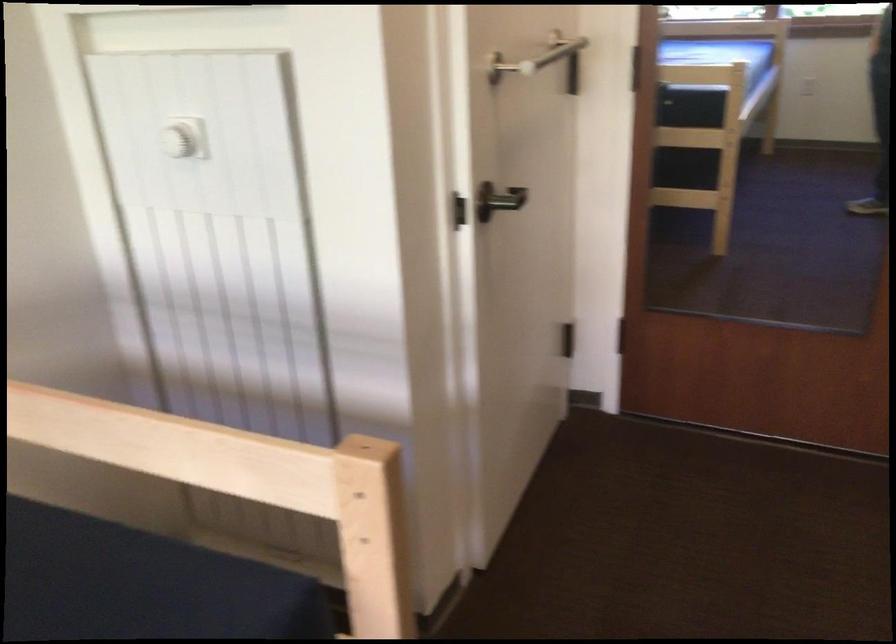
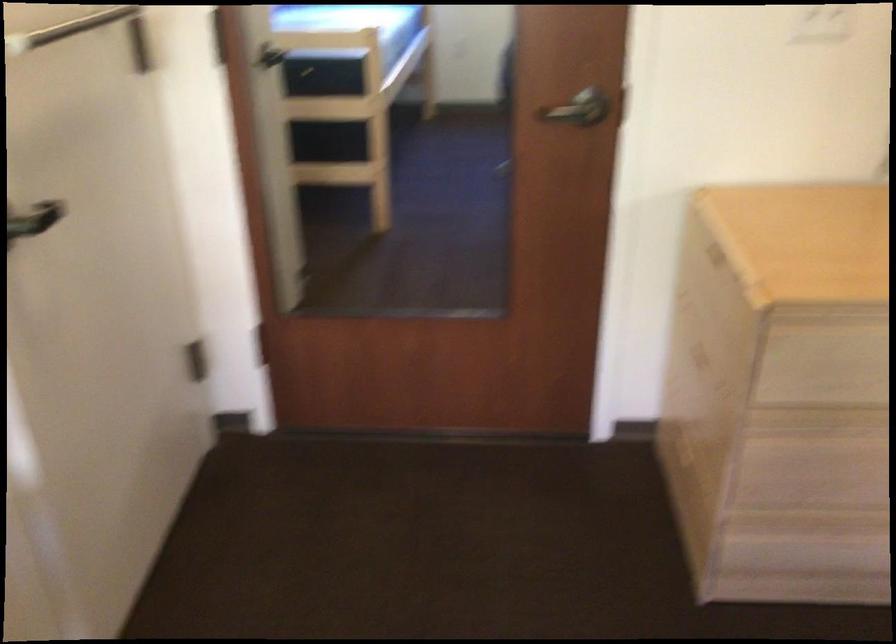
Question: How did the camera likely rotate?

Choices:
 (A) Left
 (B) Right
 (C) Up
 (D) Down

Answer: (B)